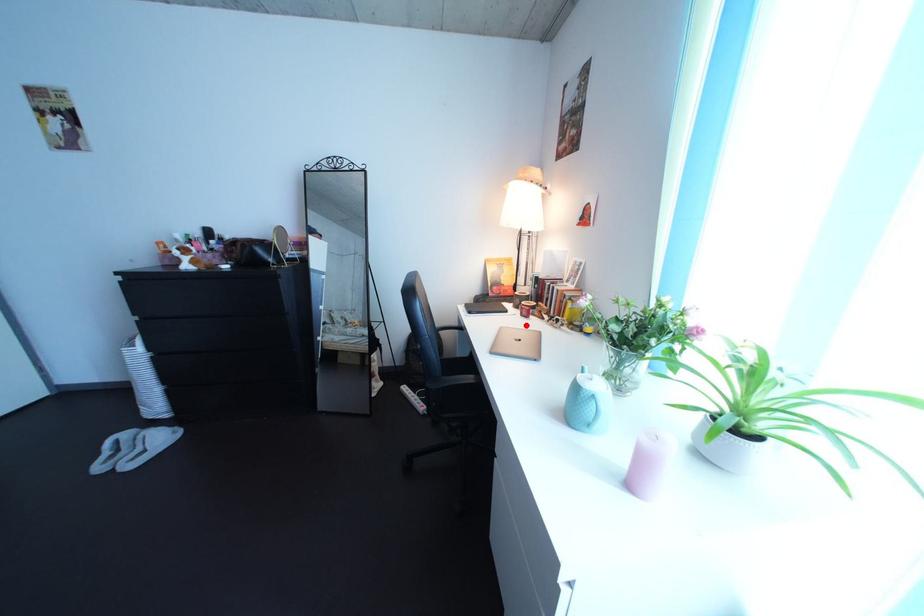
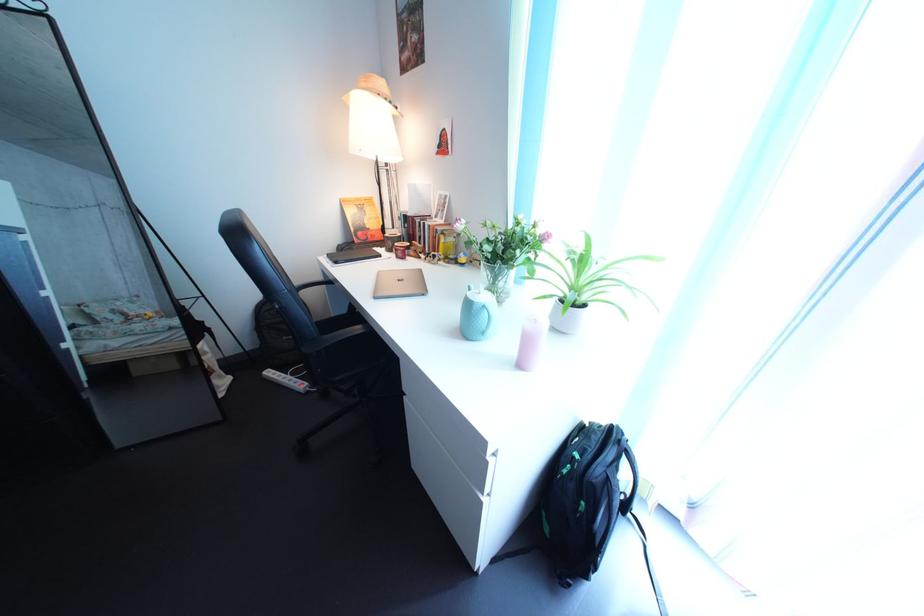
Find the pixel in the second image that matches the highlighted location in the first image.

(402, 269)